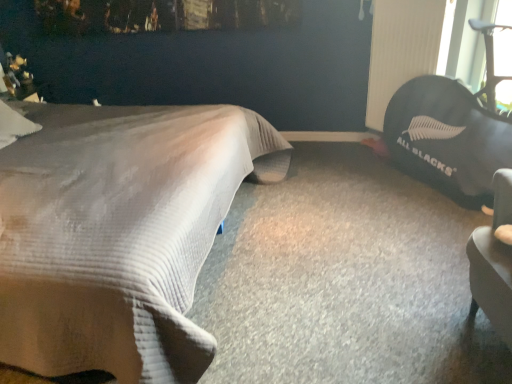
Question: From the image's perspective, does black rubber radiator at upper right appear lower than beige textured bed at left?

Choices:
 (A) yes
 (B) no

Answer: (B)

Question: Is black rubber radiator at upper right closer to camera compared to beige textured bed at left?

Choices:
 (A) no
 (B) yes

Answer: (A)

Question: Is beige textured bed at left at the back of black rubber radiator at upper right?

Choices:
 (A) no
 (B) yes

Answer: (A)

Question: Can you confirm if black rubber radiator at upper right is smaller than beige textured bed at left?

Choices:
 (A) no
 (B) yes

Answer: (B)

Question: Is black rubber radiator at upper right not inside beige textured bed at left?

Choices:
 (A) yes
 (B) no

Answer: (A)

Question: In terms of height, does black rubber radiator at upper right look taller or shorter compared to beige textured bed at left?

Choices:
 (A) short
 (B) tall

Answer: (A)

Question: Considering their positions, is black rubber radiator at upper right located in front of or behind beige textured bed at left?

Choices:
 (A) behind
 (B) front

Answer: (A)

Question: Based on their sizes in the image, would you say black rubber radiator at upper right is bigger or smaller than beige textured bed at left?

Choices:
 (A) big
 (B) small

Answer: (B)

Question: From a real-world perspective, is black rubber radiator at upper right physically located above or below beige textured bed at left?

Choices:
 (A) above
 (B) below

Answer: (A)

Question: Is beige textured bed at left inside the boundaries of black fabric bean bag at right, or outside?

Choices:
 (A) outside
 (B) inside

Answer: (A)

Question: In terms of width, does beige textured bed at left look wider or thinner when compared to black fabric bean bag at right?

Choices:
 (A) wide
 (B) thin

Answer: (A)

Question: Considering the positions of beige textured bed at left and black fabric bean bag at right in the image, is beige textured bed at left taller or shorter than black fabric bean bag at right?

Choices:
 (A) tall
 (B) short

Answer: (A)

Question: In the image, is beige textured bed at left positioned in front of or behind black fabric bean bag at right?

Choices:
 (A) front
 (B) behind

Answer: (A)

Question: Is beige textured bed at left taller or shorter than black rubber radiator at upper right?

Choices:
 (A) tall
 (B) short

Answer: (A)

Question: From a real-world perspective, is beige textured bed at left physically located above or below black rubber radiator at upper right?

Choices:
 (A) above
 (B) below

Answer: (B)